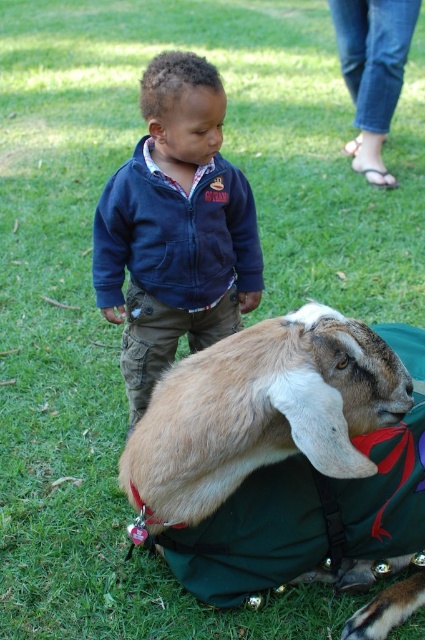
Can you confirm if light brown fur at center is positioned above navy blue fleece jacket at center?

No.

Which is in front, point (320, 545) or point (166, 310)?

Point (320, 545) is more forward.

Locate an element on the screen. light brown fur at center is located at coordinates (274, 454).